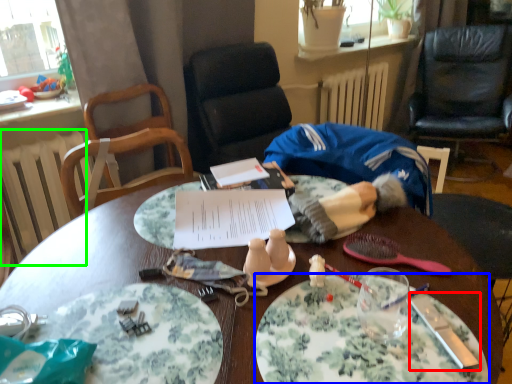
Question: Based on their relative distances, which object is farther from knife (highlighted by a red box)? Choose from plate (highlighted by a blue box) and radiator (highlighted by a green box).

Choices:
 (A) plate
 (B) radiator

Answer: (B)